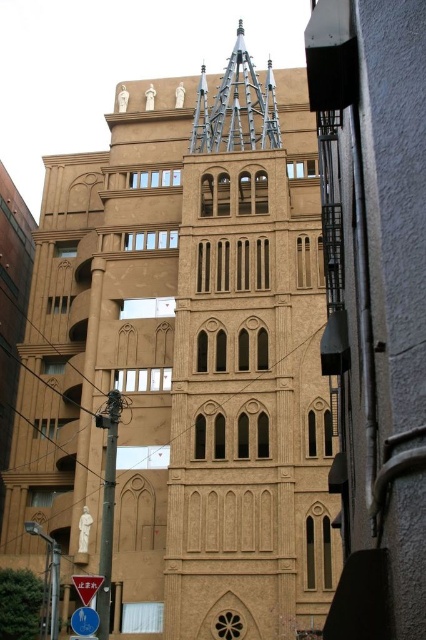
Looking at this image, is blue glossy sign at lower left positioned before white plastic sign at lower left?

Yes, it is.

Measure the distance between point (78, 632) and camera.

Point (78, 632) and camera are 38.85 meters apart from each other.

Where is `blue glossy sign at lower left`? The height and width of the screenshot is (640, 426). blue glossy sign at lower left is located at coordinates (85, 621).

Does shiny silver spire at center lie behind blue glossy sign at lower left?

Yes, shiny silver spire at center is behind blue glossy sign at lower left.

Who is shorter, shiny silver spire at center or blue glossy sign at lower left?

blue glossy sign at lower left

Who is more distant from viewer, (218, 148) or (81, 632)?

The point (218, 148) is more distant.

Where is `shiny silver spire at center`? shiny silver spire at center is located at coordinates (236, 108).

From the picture: Can you confirm if shiny silver spire at center is thinner than white plastic sign at lower left?

Incorrect, shiny silver spire at center's width is not less than white plastic sign at lower left's.

Between point (247, 100) and point (78, 595), which one is positioned behind?

Point (247, 100)

You are a GUI agent. You are given a task and a screenshot of the screen. Output one action in this format:
    pyautogui.click(x=<x>, y=<y>)
    Task: Click on the shiny silver spire at center
    
    Given the screenshot: What is the action you would take?
    pyautogui.click(x=236, y=108)